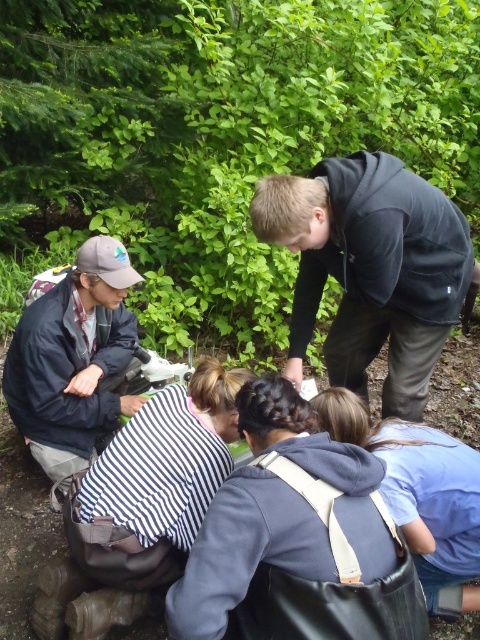
You are standing at the origin point in the forest scene. The dark gray hoodie at upper right is located at coordinates point (371, 269). If you want to reach the dark gray hoodie at upper right, in which direction should you move?

The dark gray hoodie at upper right is located at point (371, 269), so you should move towards the upper right direction to reach it.

You are an observer in the forest scene. You notice two people wearing distinct clothing items. The first is a dark gray hoodie at upper right, and the second is a white striped shirt at lower center. Which of these two clothing items is wider in the image?

The dark gray hoodie at upper right is wider than the white striped shirt at lower center according to the description.

You are part of the group in the forest and want to take a photo of the dark gray hoodie at upper right and the dark gray hoodie at center. Which one is more to the right?

The dark gray hoodie at upper right is positioned on the right side of dark gray hoodie at center, so it is more to the right.